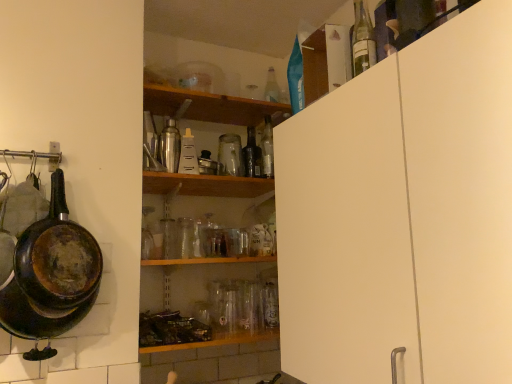
Question: Is clear glass bottle at upper center, the 6th bottle when ordered from front to back, not inside clear glass bottle at upper right, which appears as the 1th bottle when viewed from the right?

Choices:
 (A) no
 (B) yes

Answer: (B)

Question: From the image's perspective, is clear glass bottle at upper center, the 6th bottle when ordered from front to back, on top of clear glass bottle at upper right, which appears as the 1th bottle when viewed from the right?

Choices:
 (A) no
 (B) yes

Answer: (B)

Question: Considering the relative sizes of clear glass bottle at upper center, which is counted as the first bottle, starting from the back, and clear glass bottle at upper right, placed as the 1th bottle when sorted from front to back, in the image provided, is clear glass bottle at upper center, which is counted as the first bottle, starting from the back, thinner than clear glass bottle at upper right, placed as the 1th bottle when sorted from front to back,?

Choices:
 (A) no
 (B) yes

Answer: (A)

Question: Is clear glass bottle at upper center, the 6th bottle when ordered from front to back, positioned in front of clear glass bottle at upper right, which is counted as the 6th bottle, starting from the back?

Choices:
 (A) yes
 (B) no

Answer: (B)

Question: Can you confirm if clear glass bottle at upper center, which ranks as the 2th bottle in right-to-left order, is bigger than clear glass bottle at upper right, which is counted as the 6th bottle, starting from the back?

Choices:
 (A) no
 (B) yes

Answer: (B)

Question: Considering the relative sizes of clear glass bottle at upper center, the 6th bottle when ordered from front to back, and clear glass bottle at upper right, the 6th bottle from the left, in the image provided, is clear glass bottle at upper center, the 6th bottle when ordered from front to back, taller than clear glass bottle at upper right, the 6th bottle from the left,?

Choices:
 (A) no
 (B) yes

Answer: (B)

Question: Could rusty cast iron frying pan at left be considered to be inside clear plastic bottle at center, which appears as the 4th bottle when viewed from the right?

Choices:
 (A) no
 (B) yes

Answer: (A)

Question: Could you tell me if clear plastic bottle at center, the third bottle positioned from the left, is turned towards rusty cast iron frying pan at left?

Choices:
 (A) yes
 (B) no

Answer: (B)

Question: Considering the relative sizes of clear plastic bottle at center, which is counted as the 4th bottle, starting from the front, and rusty cast iron frying pan at left in the image provided, is clear plastic bottle at center, which is counted as the 4th bottle, starting from the front, thinner than rusty cast iron frying pan at left?

Choices:
 (A) no
 (B) yes

Answer: (A)

Question: Considering the relative sizes of clear plastic bottle at center, which is the 3th bottle in back-to-front order, and rusty cast iron frying pan at left in the image provided, is clear plastic bottle at center, which is the 3th bottle in back-to-front order, smaller than rusty cast iron frying pan at left?

Choices:
 (A) no
 (B) yes

Answer: (B)

Question: Is clear plastic bottle at center, which is the 3th bottle in back-to-front order, wider than rusty cast iron frying pan at left?

Choices:
 (A) no
 (B) yes

Answer: (B)

Question: Is clear plastic bottle at center, the third bottle positioned from the left, turned away from rusty cast iron frying pan at left?

Choices:
 (A) no
 (B) yes

Answer: (A)

Question: From the image's perspective, is black glass bottle at center, arranged as the third bottle when viewed from the right, located beneath metallic silver shaker at center, the sixth bottle positioned from the right?

Choices:
 (A) no
 (B) yes

Answer: (B)